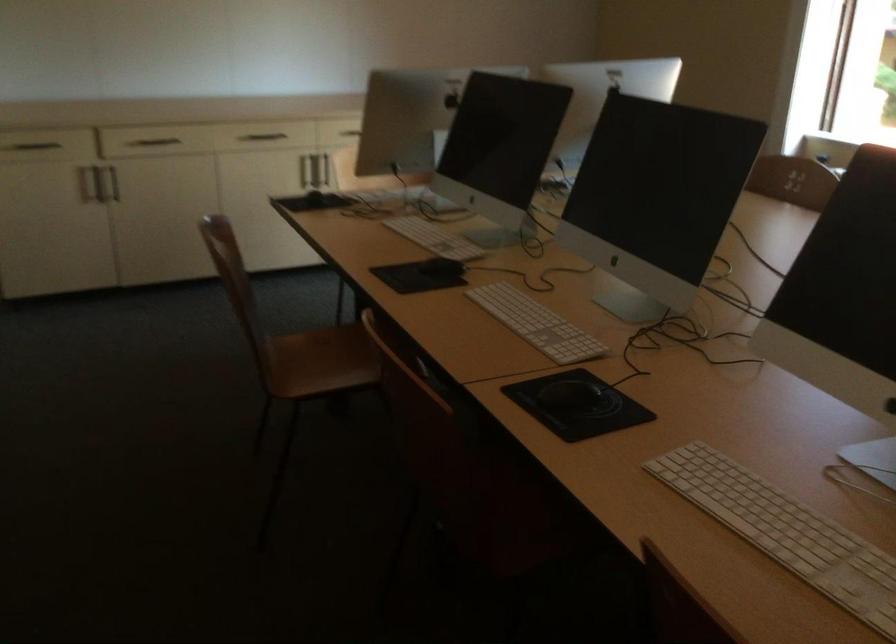
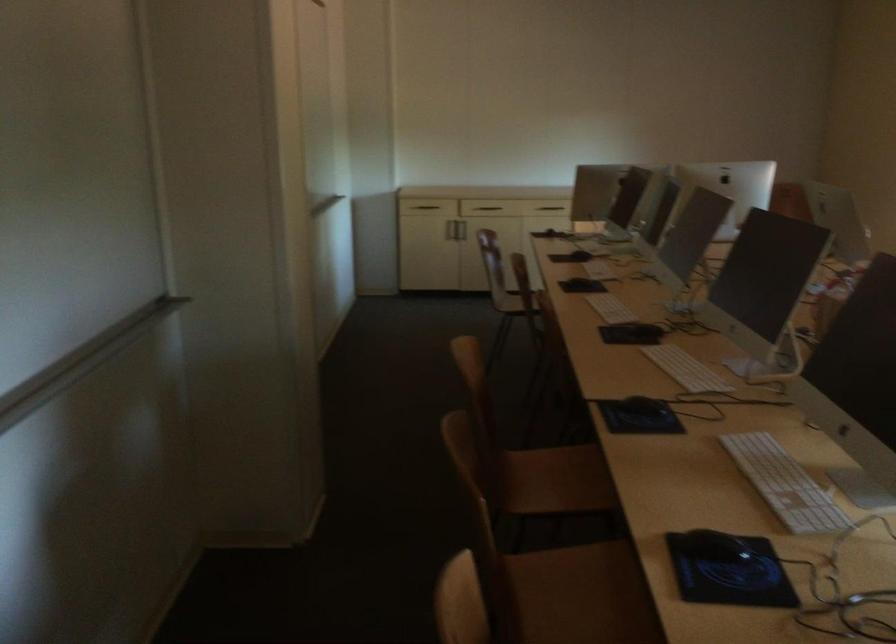
Locate, in the second image, the point that corresponds to [572,353] in the first image.

(599, 269)